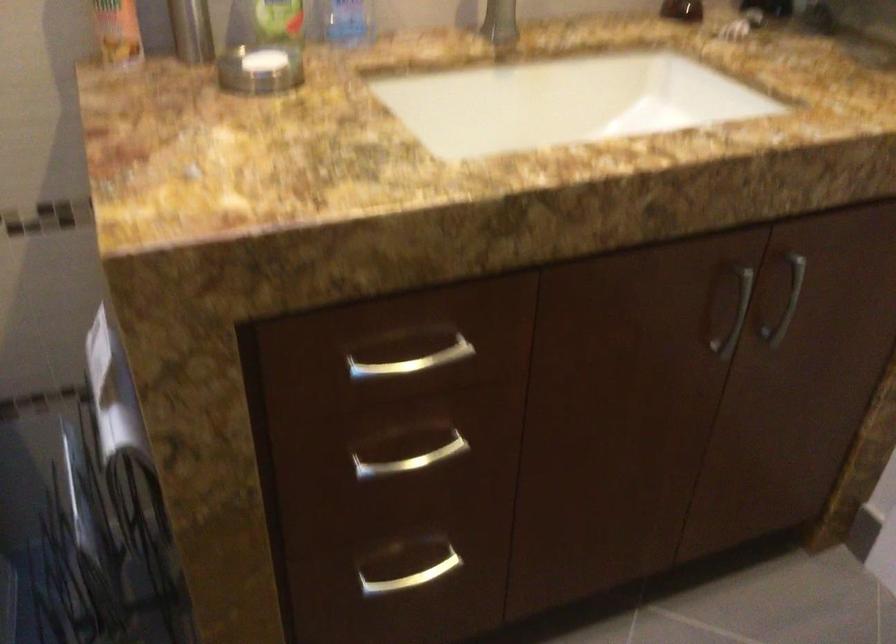
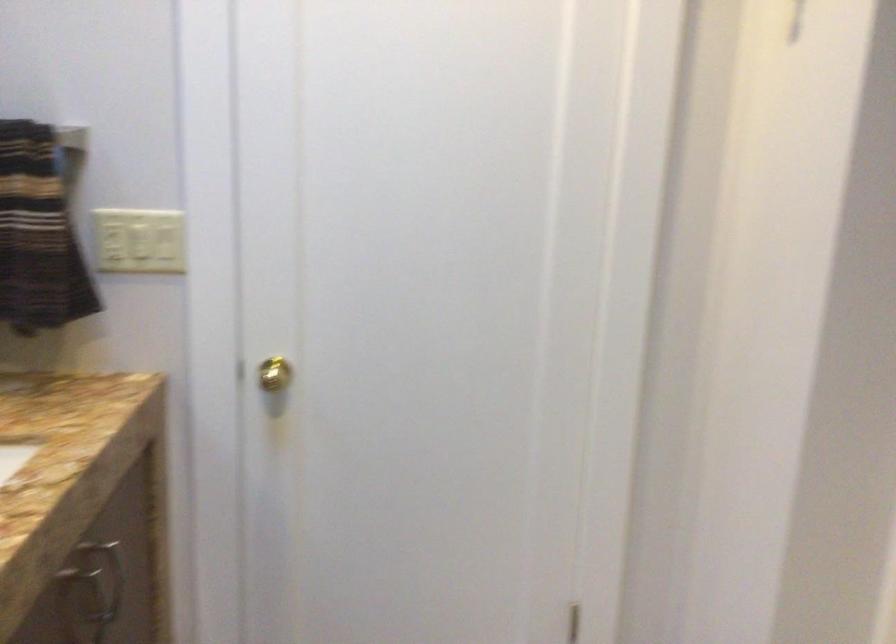
Question: The images are taken continuously from a first-person perspective. In which direction is your viewpoint rotating?

Choices:
 (A) Left
 (B) Right
 (C) Up
 (D) Down

Answer: (B)